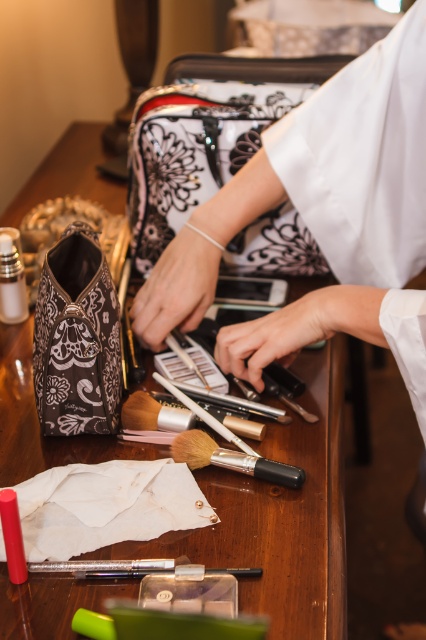
Looking at this image, you are organizing a makeup kit and need to place the black matte brush at center on the wooden table at center. Can you place it directly on top without any obstruction?

The wooden table at center is located above the black matte brush at center, so the brush is already placed on the table. No obstruction is mentioned, so it should be possible.

You have a small decorative item that is 10 cm wide. You want to place it on the wooden table at center without it hanging off the edge. Considering the black matte brush at center is already placed on the table, can you fit your item on the table?

The wooden table at center is wider than the black matte brush at center, so yes, you can place the 10 cm wide decorative item on the wooden table at center without it hanging off the edge.